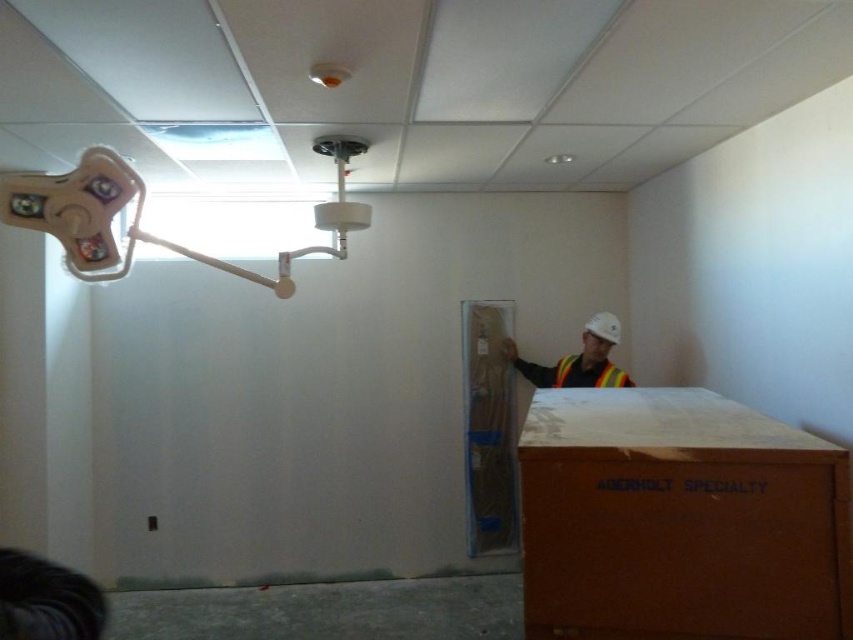
Is brown cardboard box at lower right positioned in front of white plastic light fixture at upper left?

No, it is not.

Does point (572, 401) come farther from viewer compared to point (136, 204)?

Yes, it is behind point (136, 204).

Image resolution: width=853 pixels, height=640 pixels. What are the coordinates of `brown cardboard box at lower right` in the screenshot? It's located at (679, 520).

Is brown cardboard box at lower right bigger than reflective safety vest at center?

Indeed, brown cardboard box at lower right has a larger size compared to reflective safety vest at center.

Is brown cardboard box at lower right taller than reflective safety vest at center?

Yes.

Which is in front, point (596, 486) or point (564, 356)?

Point (596, 486) is more forward.

Locate an element on the screen. brown cardboard box at lower right is located at coordinates (679, 520).

Is point (662, 492) positioned after point (556, 364)?

No, (662, 492) is in front of (556, 364).

Can you confirm if brown cardboard box at lower right is positioned below reflective yellow safety vest at center?

Yes.

The height and width of the screenshot is (640, 853). What do you see at coordinates (679, 520) in the screenshot? I see `brown cardboard box at lower right` at bounding box center [679, 520].

Where is `brown cardboard box at lower right`? brown cardboard box at lower right is located at coordinates (679, 520).